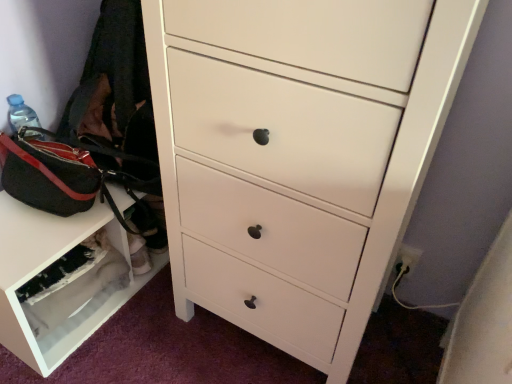
Question: Is white glossy chest of drawers at center taller or shorter than white matte shoe rack at lower left?

Choices:
 (A) tall
 (B) short

Answer: (A)

Question: From a real-world perspective, is white glossy chest of drawers at center physically located above or below white matte shoe rack at lower left?

Choices:
 (A) below
 (B) above

Answer: (B)

Question: Estimate the real-world distances between objects in this image. Which object is farther from the white glossy chest of drawers at center?

Choices:
 (A) black canvas messenger bag at left
 (B) white matte shoe rack at lower left

Answer: (A)

Question: Which of these objects is positioned farthest from the white glossy chest of drawers at center?

Choices:
 (A) white matte shoe rack at lower left
 (B) black canvas messenger bag at left

Answer: (B)